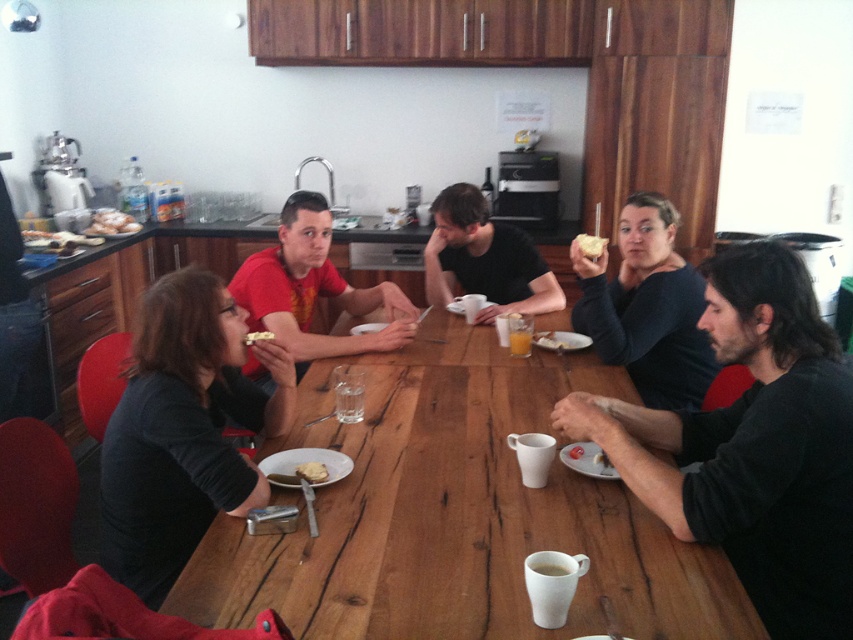
Question: Which point is closer to the camera?

Choices:
 (A) (515, 352)
 (B) (538, 337)

Answer: (A)

Question: Is matte black shirt at center wider than yellow cake at center?

Choices:
 (A) no
 (B) yes

Answer: (B)

Question: Considering the relative positions of matte white plate with food at center and golden textured bread at center in the image provided, where is matte white plate with food at center located with respect to golden textured bread at center?

Choices:
 (A) below
 (B) above

Answer: (A)

Question: Which is farther from the clear glass water at table center?

Choices:
 (A) crumbly white bread at table center
 (B) matte white bread at upper left
 (C) wooden table at center

Answer: (B)

Question: Does matte black shirt at center lie in front of golden textured bread at center?

Choices:
 (A) no
 (B) yes

Answer: (A)

Question: Which point is farther to the camera?

Choices:
 (A) wooden table at center
 (B) white crumbly bread at upper center

Answer: (B)